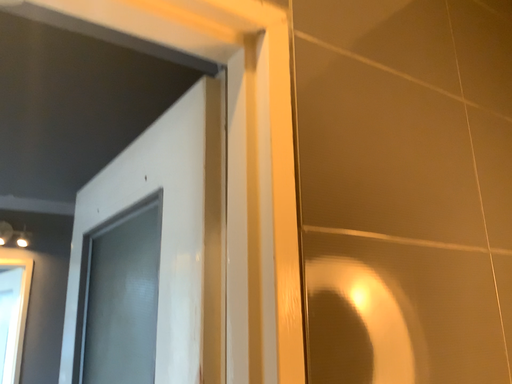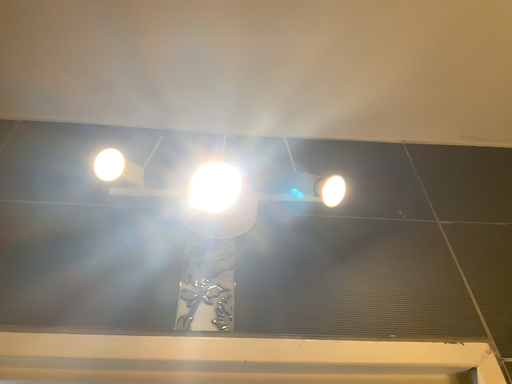
Question: Which way did the camera rotate in the video?

Choices:
 (A) rotated left
 (B) rotated right

Answer: (A)